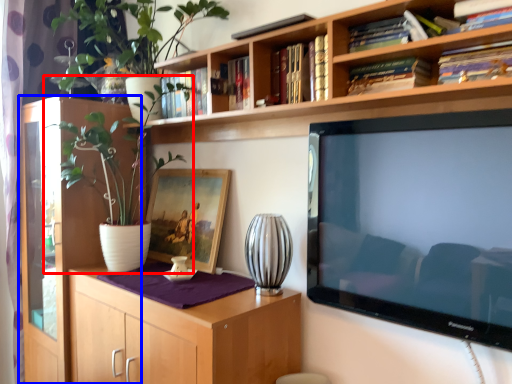
Question: Which object is further to the camera taking this photo, houseplant (highlighted by a red box) or cabinetry (highlighted by a blue box)?

Choices:
 (A) houseplant
 (B) cabinetry

Answer: (B)